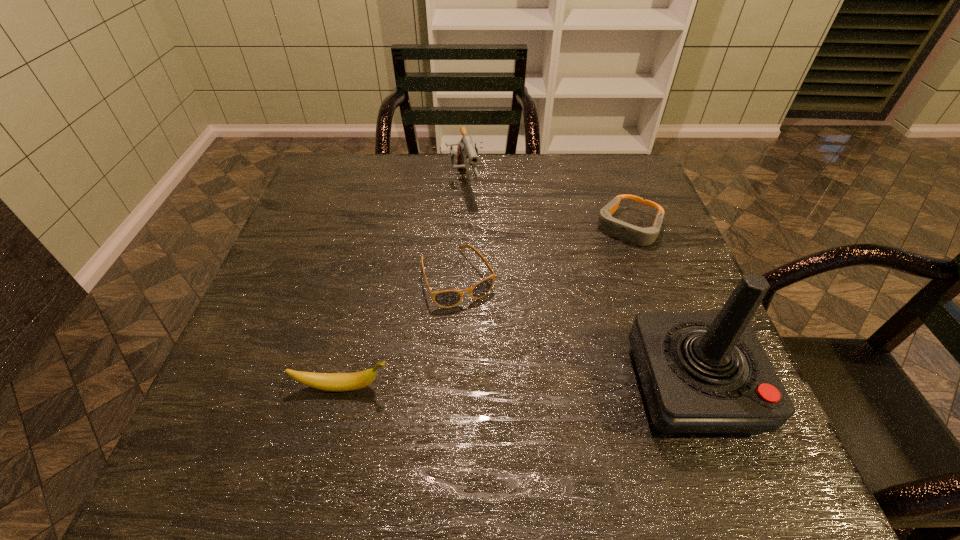
Find the location of a particular element. The width and height of the screenshot is (960, 540). joystick situated at the right edge is located at coordinates (701, 373).

This screenshot has width=960, height=540. What are the coordinates of `goggles that is at the right edge` in the screenshot? It's located at (632, 234).

The image size is (960, 540). In order to click on object located in the near left corner section of the desktop in this screenshot , I will do pyautogui.click(x=337, y=382).

In order to click on object located in the near right corner section of the desktop in this screenshot , I will do `click(701, 373)`.

Find the location of a particular element. free space at the far edge of the desktop is located at coordinates (539, 194).

Image resolution: width=960 pixels, height=540 pixels. I want to click on vacant space at the near edge, so click(516, 387).

The image size is (960, 540). I want to click on free region at the left edge of the desktop, so click(x=269, y=342).

Find the location of `blank space at the right edge of the desktop`. blank space at the right edge of the desktop is located at coordinates (630, 202).

Find the location of `free space between the gun and the third shortest object`. free space between the gun and the third shortest object is located at coordinates (401, 286).

At what (x,y) coordinates should I click in order to perform the action: click on free space between the joystick and the goggles. Please return your answer as a coordinate pair (x, y). The image size is (960, 540). Looking at the image, I should click on (660, 307).